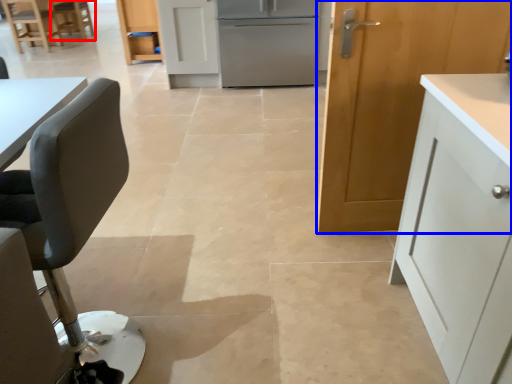
Question: Which point is further to the camera, chair (highlighted by a red box) or cabinetry (highlighted by a blue box)?

Choices:
 (A) chair
 (B) cabinetry

Answer: (A)